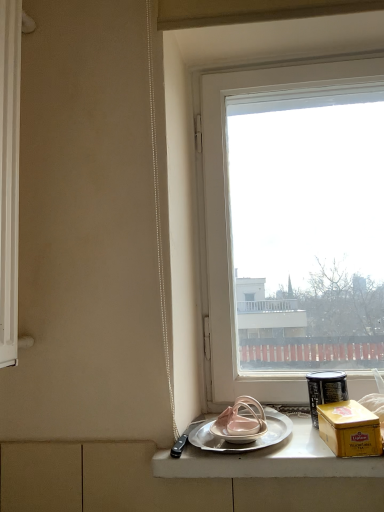
Question: From a real-world perspective, is yellow matte box at right above or below silver metallic plate at lower center?

Choices:
 (A) below
 (B) above

Answer: (B)

Question: From the image's perspective, relative to silver metallic plate at lower center, is yellow matte box at right above or below?

Choices:
 (A) below
 (B) above

Answer: (B)

Question: Which object is the farthest from the silver metallic tray at lower center?

Choices:
 (A) metallic silver canister at right
 (B) yellow matte box at right
 (C) silver metallic plate at lower center
 (D) transparent glass window at center

Answer: (D)

Question: Which object is positioned farthest from the yellow matte box at right?

Choices:
 (A) silver metallic tray at lower center
 (B) transparent glass window at center
 (C) metallic silver canister at right
 (D) silver metallic plate at lower center

Answer: (B)